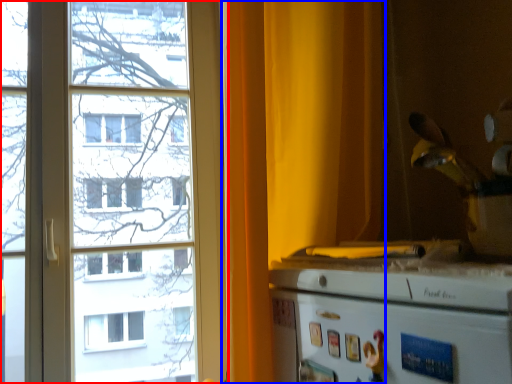
Question: Which point is closer to the camera, window (highlighted by a red box) or curtain (highlighted by a blue box)?

Choices:
 (A) window
 (B) curtain

Answer: (B)